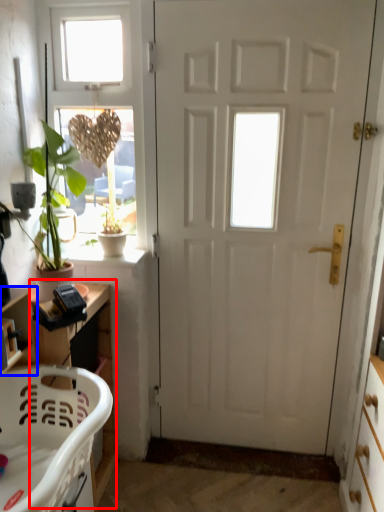
Question: Which of the following is the closest to the observer, cabinetry (highlighted by a red box) or shelf (highlighted by a blue box)?

Choices:
 (A) cabinetry
 (B) shelf

Answer: (B)